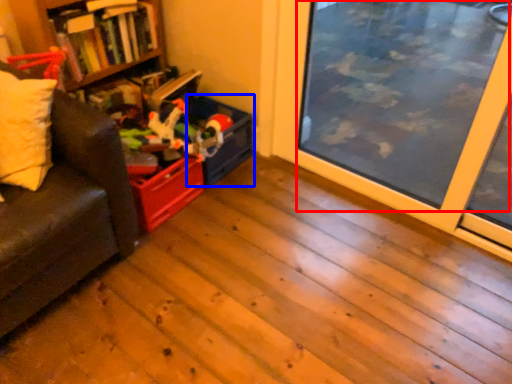
Question: Which of the following is the farthest to the observer, window screen (highlighted by a red box) or storage box (highlighted by a blue box)?

Choices:
 (A) window screen
 (B) storage box

Answer: (B)